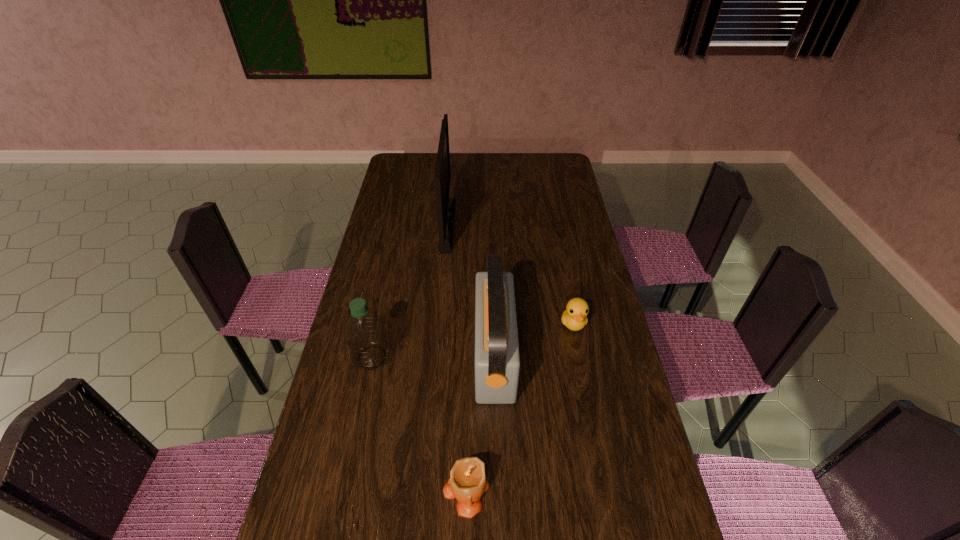
Where is `the closest object relative to the third tallest object`? the closest object relative to the third tallest object is located at coordinates (497, 361).

You are a GUI agent. You are given a task and a screenshot of the screen. Output one action in this format:
    pyautogui.click(x=<x>, y=<y>)
    Task: Click on the vacant region that satisfies the following two spatial constraints: 1. on the front-facing side of the tallest object; 2. on the back side of the candle
    The image size is (960, 540).
    Given the screenshot: What is the action you would take?
    pyautogui.click(x=424, y=490)

Where is `vacant space that satisfies the following two spatial constraints: 1. on the face of the duck; 2. on the front-facing side of the radio receiver`? This screenshot has width=960, height=540. vacant space that satisfies the following two spatial constraints: 1. on the face of the duck; 2. on the front-facing side of the radio receiver is located at coordinates (580, 355).

Where is `vacant position in the image that satisfies the following two spatial constraints: 1. on the front-facing side of the fourth object from right to left; 2. on the back side of the candle`? This screenshot has height=540, width=960. vacant position in the image that satisfies the following two spatial constraints: 1. on the front-facing side of the fourth object from right to left; 2. on the back side of the candle is located at coordinates (424, 490).

Locate an element on the screen. The height and width of the screenshot is (540, 960). vacant position in the image that satisfies the following two spatial constraints: 1. on the front side of the leftmost object; 2. on the left side of the nearest object is located at coordinates (344, 490).